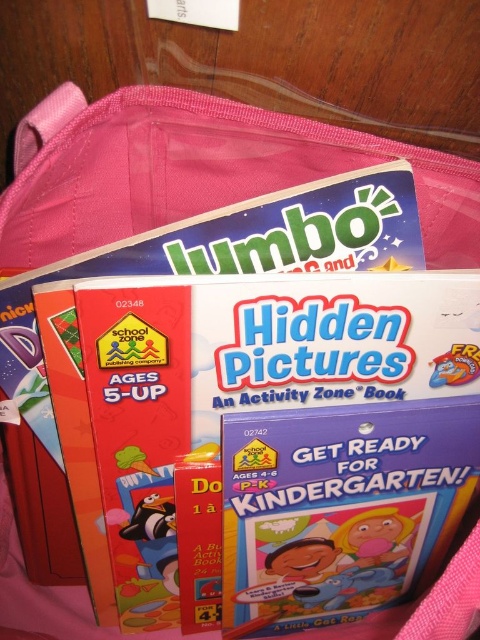
Question: Where is matte pink book at center located in relation to shiny metallic sticker at center in the image?

Choices:
 (A) above
 (B) below

Answer: (B)

Question: Can you confirm if shiny metallic sticker at center is positioned below green matte ice cream cone at center?

Choices:
 (A) yes
 (B) no

Answer: (B)

Question: Among these points, which one is farthest from the camera?

Choices:
 (A) (145, 604)
 (B) (266, 572)
 (C) (455, 342)

Answer: (A)

Question: Can you confirm if matte pink book at center is positioned above matte plastic penguin at center?

Choices:
 (A) yes
 (B) no

Answer: (B)

Question: Which of the following is the farthest from the observer?

Choices:
 (A) (173, 392)
 (B) (266, 554)
 (C) (359, 548)
 (D) (140, 449)

Answer: (C)

Question: Estimate the real-world distances between objects in this image. Which object is farther from the shiny metallic sticker at center?

Choices:
 (A) matte plastic penguin at center
 (B) white paper lunch box at center
 (C) matte plastic spoon at center
 (D) green matte ice cream cone at center

Answer: (A)